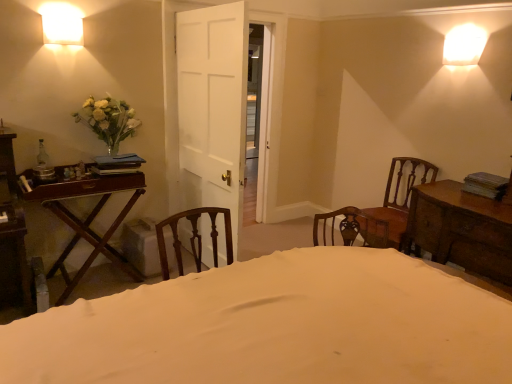
Find the location of `vacant region above wooden chest of drawers at right, the second table from the left (from a real-world perspective)`. vacant region above wooden chest of drawers at right, the second table from the left (from a real-world perspective) is located at coordinates (456, 197).